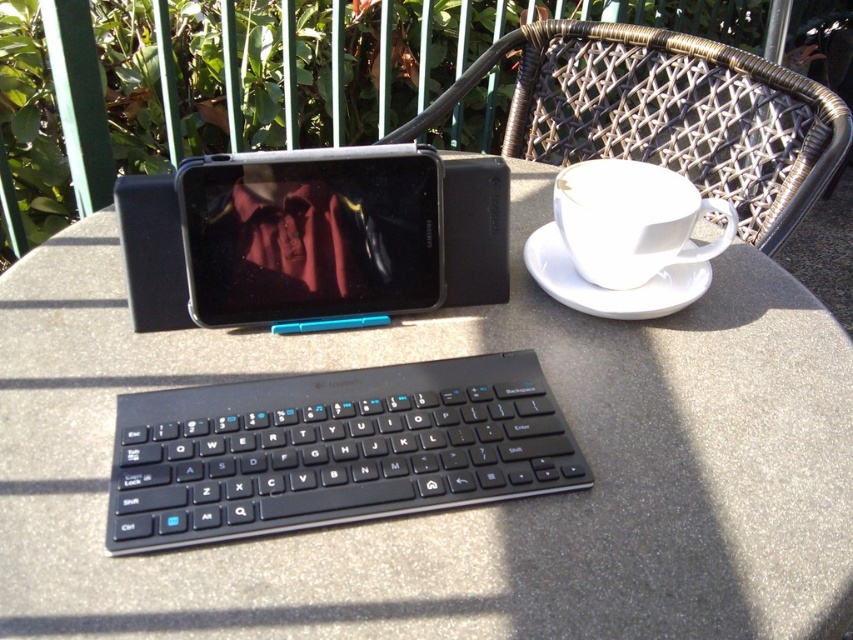
Question: Which point appears closest to the camera in this image?

Choices:
 (A) (323, 198)
 (B) (683, 276)
 (C) (686, 250)
 (D) (466, 378)

Answer: (D)

Question: Can you confirm if woven rattan chair at upper right is positioned below white ceramic saucer at right?

Choices:
 (A) no
 (B) yes

Answer: (A)

Question: Estimate the real-world distances between objects in this image. Which object is closer to the black plastic tablet at upper center?

Choices:
 (A) woven rattan chair at upper right
 (B) white ceramic saucer at right
 (C) black plastic keyboard at center

Answer: (C)

Question: Which object is the closest to the black plastic keyboard at center?

Choices:
 (A) woven rattan chair at upper right
 (B) white ceramic cup at upper right

Answer: (B)

Question: Can you confirm if black plastic keyboard at center is positioned below white ceramic cup at upper right?

Choices:
 (A) yes
 (B) no

Answer: (A)

Question: Does black plastic keyboard at center have a smaller size compared to white ceramic cup at upper right?

Choices:
 (A) no
 (B) yes

Answer: (A)